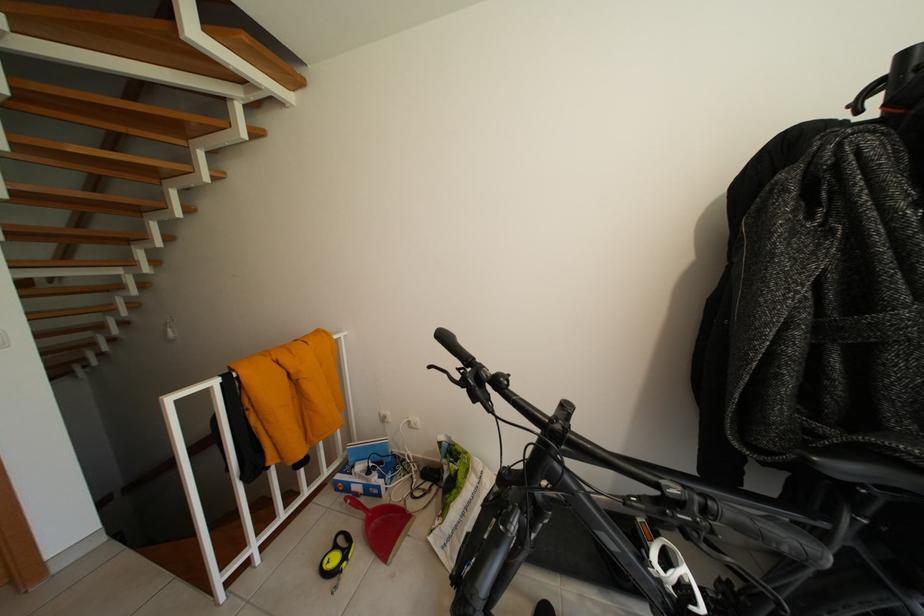
What do you see at coordinates (114, 113) in the screenshot?
I see `the white stair railing` at bounding box center [114, 113].